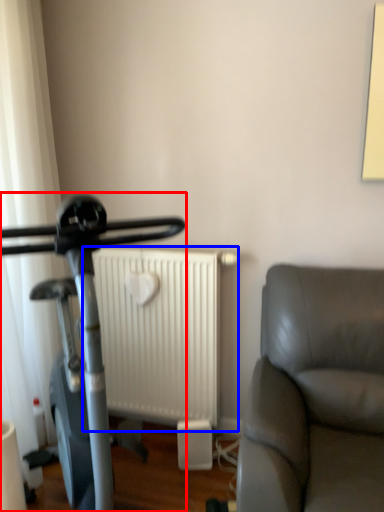
Question: Among these objects, which one is nearest to the camera, stationary bicycle (highlighted by a red box) or radiator (highlighted by a blue box)?

Choices:
 (A) stationary bicycle
 (B) radiator

Answer: (A)